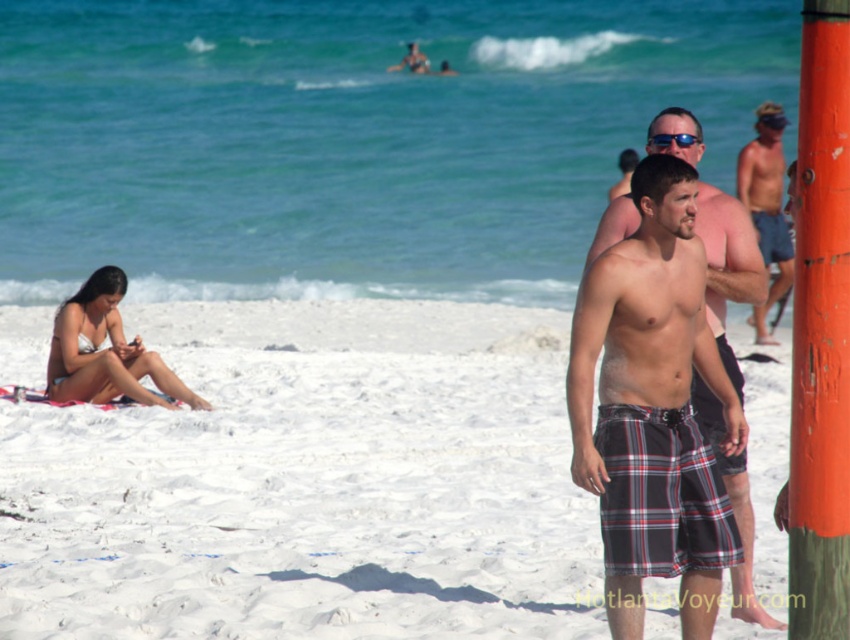
Question: Which object is closer to the camera taking this photo?

Choices:
 (A) matte skin man at right
 (B) white matte bikini at lower left

Answer: (A)

Question: Considering the relative positions of white sand at lower left and matte skin man at right in the image provided, where is white sand at lower left located with respect to matte skin man at right?

Choices:
 (A) below
 (B) above

Answer: (A)

Question: Is orange painted wood post at right above plaid shorts at center?

Choices:
 (A) no
 (B) yes

Answer: (A)

Question: Estimate the real-world distances between objects in this image. Which object is farther from the blue reflective sunglasses at upper center?

Choices:
 (A) white sand at lower left
 (B) orange painted wood post at right
 (C) plaid shorts at center

Answer: (A)

Question: Is white sand at lower left bigger than blue reflective sunglasses at upper center?

Choices:
 (A) yes
 (B) no

Answer: (A)

Question: Which of the following is the farthest from the observer?

Choices:
 (A) matte skin man at right
 (B) plaid shorts at center
 (C) orange painted wood post at right

Answer: (A)